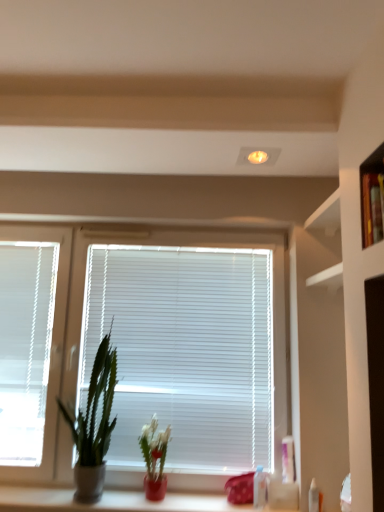
This screenshot has width=384, height=512. I want to click on white glossy counter at lower center, so click(114, 501).

This screenshot has height=512, width=384. What do you see at coordinates (114, 501) in the screenshot?
I see `white glossy counter at lower center` at bounding box center [114, 501].

What do you see at coordinates (52, 345) in the screenshot?
I see `white plastic blinds at left` at bounding box center [52, 345].

What do you see at coordinates (259, 487) in the screenshot? This screenshot has height=512, width=384. I see `transparent plastic bottle at lower right, which is counted as the first toiletry, starting from the left` at bounding box center [259, 487].

The height and width of the screenshot is (512, 384). I want to click on white glossy counter at lower center, so click(x=114, y=501).

From a real-world perspective, which is physically below, transparent plastic bottle at lower right, placed as the second toiletry when sorted from right to left, or matte ceramic plant at lower center, placed as the first houseplant when sorted from right to left?

In real-world perspective, transparent plastic bottle at lower right, placed as the second toiletry when sorted from right to left, is lower.

From the image's perspective, which one is positioned higher, transparent plastic bottle at lower right, placed as the second toiletry when sorted from right to left, or matte ceramic plant at lower center, which appears as the second houseplant when viewed from the left?

From the image's view, matte ceramic plant at lower center, which appears as the second houseplant when viewed from the left, is above.

Based on the photo, considering the sizes of objects transparent plastic bottle at lower right, placed as the second toiletry when sorted from right to left, and matte ceramic plant at lower center, which appears as the second houseplant when viewed from the left, in the image provided, who is smaller, transparent plastic bottle at lower right, placed as the second toiletry when sorted from right to left, or matte ceramic plant at lower center, which appears as the second houseplant when viewed from the left,?

Smaller between the two is transparent plastic bottle at lower right, placed as the second toiletry when sorted from right to left.

Is transparent plastic bottle at lower right, the 2th toiletry in the front-to-back sequence, placed right next to matte ceramic plant at lower center, placed as the first houseplant when sorted from right to left?

No, transparent plastic bottle at lower right, the 2th toiletry in the front-to-back sequence, is not beside matte ceramic plant at lower center, placed as the first houseplant when sorted from right to left.

Which is in front, white plastic blinds at left or transparent plastic bottle at lower right, placed as the first toiletry when sorted from back to front?

Positioned in front is transparent plastic bottle at lower right, placed as the first toiletry when sorted from back to front.

Is point (49, 423) less distant than point (263, 489)?

No, (49, 423) is behind (263, 489).

You are a GUI agent. You are given a task and a screenshot of the screen. Output one action in this format:
    pyautogui.click(x=<x>, y=<y>)
    Task: Click on the window that appears on the left of transparent plastic bottle at lower right, placed as the first toiletry when sorted from back to front
    
    Given the screenshot: What is the action you would take?
    pyautogui.click(x=52, y=345)

Is transparent plastic bottle at lower right, the 2th toiletry in the front-to-back sequence, at the back of white plastic blinds at left?

white plastic blinds at left is not turned away from transparent plastic bottle at lower right, the 2th toiletry in the front-to-back sequence.

Is white plastic blinds at center facing away from green matte plant at left, the second houseplant in the right-to-left sequence?

That's right, white plastic blinds at center is facing away from green matte plant at left, the second houseplant in the right-to-left sequence.

Between white plastic blinds at center and green matte plant at left, the second houseplant in the right-to-left sequence, which one has larger size?

Bigger between the two is white plastic blinds at center.

Is white plastic blinds at center to the left of green matte plant at left, which ranks as the 1th houseplant in left-to-right order, from the viewer's perspective?

In fact, white plastic blinds at center is to the right of green matte plant at left, which ranks as the 1th houseplant in left-to-right order.

In the scene shown: Is white plastic blinds at center not close to green matte plant at left, the second houseplant in the right-to-left sequence?

That's not correct — white plastic blinds at center is a little close to green matte plant at left, the second houseplant in the right-to-left sequence.

Is white plastic blinds at center directly adjacent to transparent plastic bottle at lower right, placed as the second toiletry when sorted from right to left?

white plastic blinds at center and transparent plastic bottle at lower right, placed as the second toiletry when sorted from right to left, are clearly separated.

Is white plastic blinds at center situated inside transparent plastic bottle at lower right, placed as the first toiletry when sorted from back to front, or outside?

white plastic blinds at center lies outside transparent plastic bottle at lower right, placed as the first toiletry when sorted from back to front.

Considering the relative sizes of white plastic blinds at center and transparent plastic bottle at lower right, which is counted as the first toiletry, starting from the left, in the image provided, is white plastic blinds at center bigger than transparent plastic bottle at lower right, which is counted as the first toiletry, starting from the left,?

Correct, white plastic blinds at center is larger in size than transparent plastic bottle at lower right, which is counted as the first toiletry, starting from the left.

Does point (170, 495) come in front of point (91, 382)?

Yes.

Is white glossy counter at lower center in front of or behind green matte plant at left, the second houseplant in the right-to-left sequence, in the image?

Clearly, white glossy counter at lower center is behind green matte plant at left, the second houseplant in the right-to-left sequence.

Can you confirm if white glossy counter at lower center is bigger than green matte plant at left, the second houseplant in the right-to-left sequence?

No.

Is green matte plant at left, the second houseplant in the right-to-left sequence, at the back of white glossy counter at lower center?

No, white glossy counter at lower center is not facing away from green matte plant at left, the second houseplant in the right-to-left sequence.

From the picture: Would you consider white plastic blinds at left to be distant from green matte plant at left, which ranks as the 1th houseplant in left-to-right order?

No, white plastic blinds at left is not far from green matte plant at left, which ranks as the 1th houseplant in left-to-right order.

Find the location of a particular element. This screenshot has width=384, height=512. window behind the green matte plant at left, the second houseplant in the right-to-left sequence is located at coordinates (52, 345).

Which is more to the right, white plastic blinds at left or green matte plant at left, the second houseplant in the right-to-left sequence?

green matte plant at left, the second houseplant in the right-to-left sequence.

Can we say white plastic blinds at left lies outside green matte plant at left, the second houseplant in the right-to-left sequence?

A: Indeed, white plastic blinds at left is completely outside green matte plant at left, the second houseplant in the right-to-left sequence.

Which of these two, matte ceramic plant at lower center, which appears as the second houseplant when viewed from the left, or white plastic blinds at left, is bigger?

Bigger between the two is white plastic blinds at left.

At what (x,y) coordinates should I click in order to perform the action: click on houseplant that is the 2nd one below the white plastic blinds at left (from a real-world perspective). Please return your answer as a coordinate pair (x, y). Looking at the image, I should click on (154, 459).

Is matte ceramic plant at lower center, which appears as the second houseplant when viewed from the left, taller than white plastic blinds at left?

In fact, matte ceramic plant at lower center, which appears as the second houseplant when viewed from the left, may be shorter than white plastic blinds at left.

Considering the points (165, 440) and (47, 394), which point is behind, point (165, 440) or point (47, 394)?

Positioned behind is point (47, 394).

Find the location of a particular element. Image resolution: width=384 pixels, height=512 pixels. toiletry that is the 1st one when counting downward from the matte ceramic plant at lower center, placed as the first houseplant when sorted from right to left (from the image's perspective) is located at coordinates (259, 487).

Where is `window that is behind the transparent plastic bottle at lower right, placed as the second toiletry when sorted from right to left`? The image size is (384, 512). window that is behind the transparent plastic bottle at lower right, placed as the second toiletry when sorted from right to left is located at coordinates (52, 345).

From the image, which object appears to be farther from white plastic bottle at lower right, the first toiletry in the right-to-left sequence, green matte plant at left, the second houseplant in the right-to-left sequence, or matte ceramic plant at lower center, placed as the first houseplant when sorted from right to left?

green matte plant at left, the second houseplant in the right-to-left sequence, is further to white plastic bottle at lower right, the first toiletry in the right-to-left sequence.

Based on their spatial positions, is white plastic blinds at left or matte ceramic plant at lower center, placed as the first houseplant when sorted from right to left, further from white plastic bottle at lower right, the 2th toiletry when ordered from left to right?

white plastic blinds at left is further to white plastic bottle at lower right, the 2th toiletry when ordered from left to right.

From the image, which object appears to be farther from white plastic blinds at center, green matte plant at left, the second houseplant in the right-to-left sequence, or white plastic blinds at left?

white plastic blinds at left is positioned further to the anchor white plastic blinds at center.

When comparing their distances from white plastic blinds at left, does white plastic bottle at lower right, which is the second toiletry in back-to-front order, or matte ceramic plant at lower center, which appears as the second houseplant when viewed from the left, seem further?

Among the two, white plastic bottle at lower right, which is the second toiletry in back-to-front order, is located further to white plastic blinds at left.

Looking at the image, which one is located closer to green matte plant at left, the second houseplant in the right-to-left sequence, white plastic bottle at lower right, which is the second toiletry in back-to-front order, or white plastic blinds at center?

white plastic blinds at center is positioned closer to the anchor green matte plant at left, the second houseplant in the right-to-left sequence.

Which object lies nearer to the anchor point white plastic bottle at lower right, the 2th toiletry when ordered from left to right, white plastic blinds at left or transparent plastic bottle at lower right, placed as the second toiletry when sorted from right to left?

Among the two, transparent plastic bottle at lower right, placed as the second toiletry when sorted from right to left, is located nearer to white plastic bottle at lower right, the 2th toiletry when ordered from left to right.

When comparing their distances from white plastic bottle at lower right, which is the second toiletry in back-to-front order, does white glossy counter at lower center or white plastic blinds at center seem closer?

white glossy counter at lower center is closer to white plastic bottle at lower right, which is the second toiletry in back-to-front order.

Based on their spatial positions, is matte ceramic plant at lower center, placed as the first houseplant when sorted from right to left, or green matte plant at left, which ranks as the 1th houseplant in left-to-right order, closer to white glossy counter at lower center?

matte ceramic plant at lower center, placed as the first houseplant when sorted from right to left, is positioned closer to the anchor white glossy counter at lower center.

Where is `toiletry between white glossy counter at lower center and white plastic bottle at lower right, which is the second toiletry in back-to-front order, from left to right`? The image size is (384, 512). toiletry between white glossy counter at lower center and white plastic bottle at lower right, which is the second toiletry in back-to-front order, from left to right is located at coordinates (259, 487).

This screenshot has width=384, height=512. Identify the location of counter situated between white plastic blinds at left and matte ceramic plant at lower center, placed as the first houseplant when sorted from right to left, from left to right. (114, 501).

The image size is (384, 512). Find the location of `houseplant between white glossy counter at lower center and white plastic bottle at lower right, the first toiletry in the right-to-left sequence, from left to right`. houseplant between white glossy counter at lower center and white plastic bottle at lower right, the first toiletry in the right-to-left sequence, from left to right is located at coordinates (154, 459).

Identify the location of window blind between white plastic blinds at left and matte ceramic plant at lower center, placed as the first houseplant when sorted from right to left. The height and width of the screenshot is (512, 384). pyautogui.click(x=192, y=354).